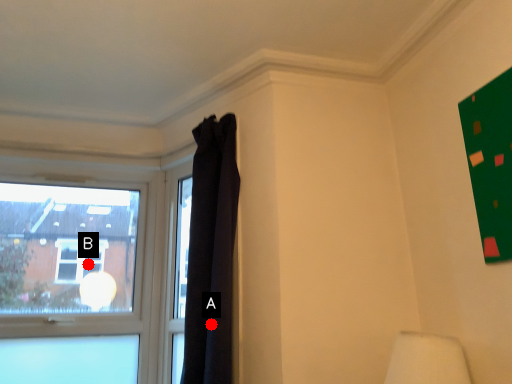
Question: Two points are circled on the image, labeled by A and B beside each circle. Which point appears closest to the camera in this image?

Choices:
 (A) A is closer
 (B) B is closer

Answer: (A)